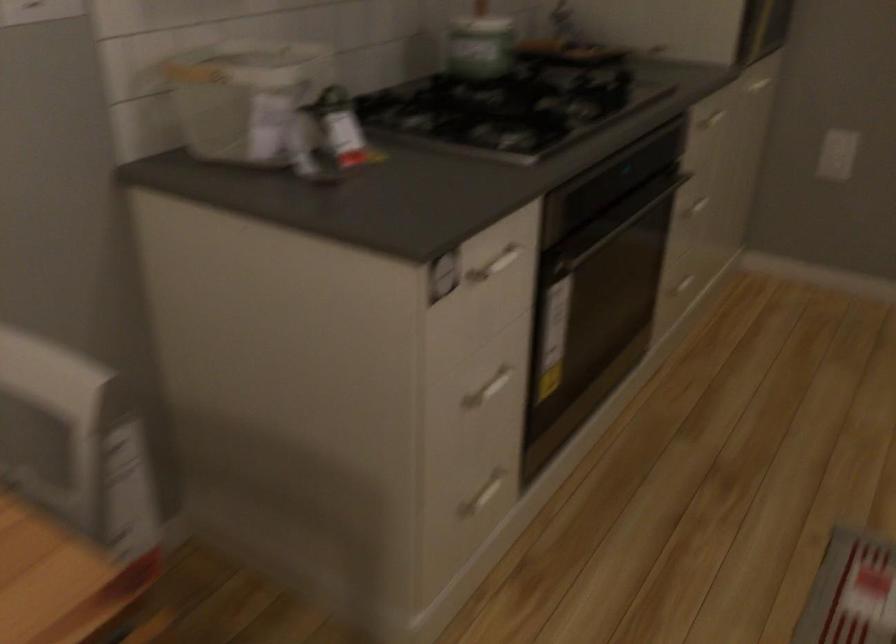
The width and height of the screenshot is (896, 644). What do you see at coordinates (487, 389) in the screenshot?
I see `a white cabinet handle` at bounding box center [487, 389].